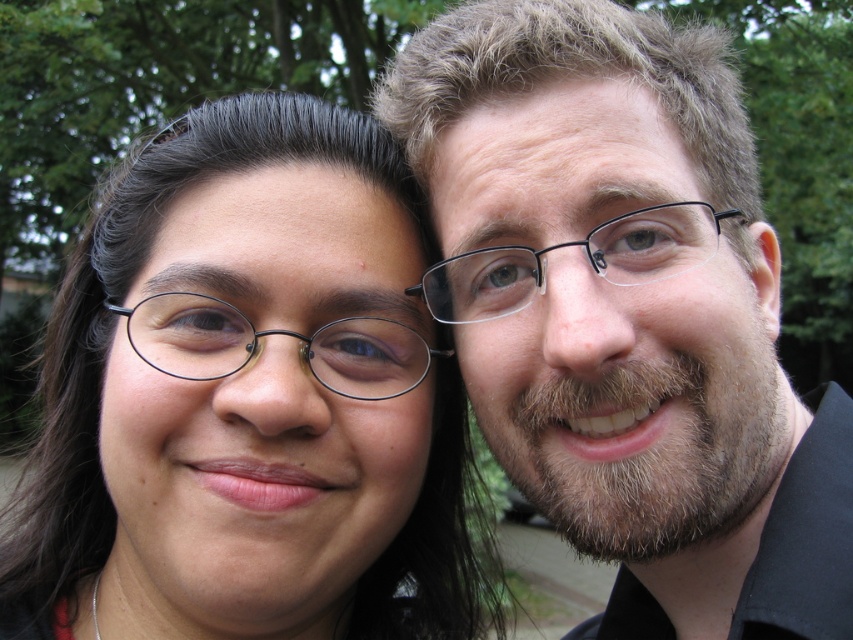
You are taking a photo of two people standing in a park. You want to ensure that the point at coordinates point (553, 467) is in focus. If your camera has a depth of field that can cover 25 inches, will this point be within the depth of field?

The point at coordinates point (553, 467) is 24.37 inches away from the camera, which is within the 25 inches depth of field. Therefore, the point will be in focus.

In the scene shown: You are a photographer standing 24 inches away from the subjects in the image. You want to capture a closeup shot of the matte black glasses at center. Is your current distance sufficient to focus on the glasses without moving closer?

The matte black glasses at center is 23.31 inches away from viewer. Since you are standing 24 inches away, you are slightly farther than the glasses, so you might need to move 0.69 inches closer to ensure proper focus for the closeup shot.